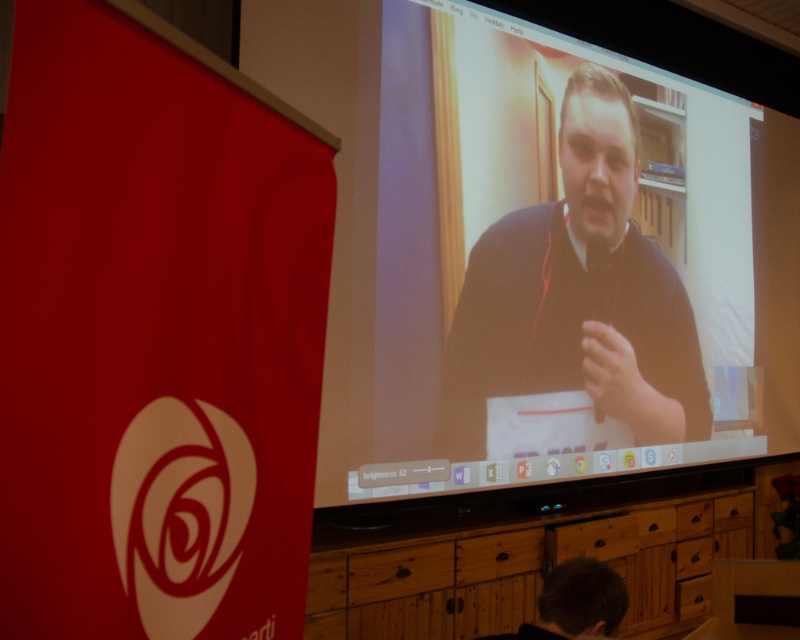
You are setting up a video call and need to ensure that both the matte black laptop at upper center and the dark brown hair at lower center are visible. Which object should you adjust to make sure both are in frame?

The matte black laptop at upper center is positioned over dark brown hair at lower center. To ensure both are visible, you should adjust the matte black laptop at upper center to move it away from the dark brown hair at lower center so they are not overlapping.

You are standing at point (678, 321) in the room. The screen displaying the video call is 13.24 feet away from you. Can you comfortably reach the screen to adjust it without moving your position?

The screen is 13.24 feet away from you at point (678, 321), which is too far to comfortably reach without moving. You would need to move closer to adjust it.